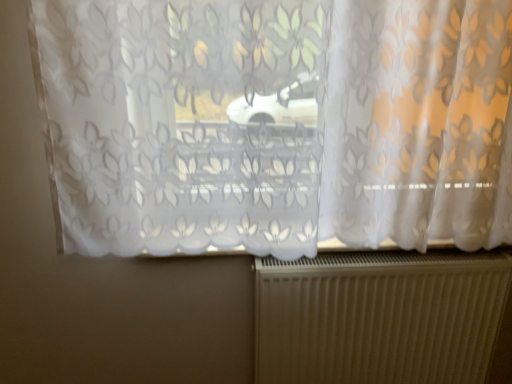
Identify the location of metallic ribbed radiator at bottom. The width and height of the screenshot is (512, 384). (380, 316).

In order to face metallic ribbed radiator at bottom, should I rotate leftwards or rightwards?

A 15.845 degree turn to the right will do.

What do you see at coordinates (380, 316) in the screenshot?
I see `metallic ribbed radiator at bottom` at bounding box center [380, 316].

Describe the element at coordinates (276, 123) in the screenshot. The height and width of the screenshot is (384, 512). I see `translucent floral-patterned curtain at center` at that location.

Find the location of `translucent floral-patterned curtain at center`. translucent floral-patterned curtain at center is located at coordinates (276, 123).

Locate an element on the screen. metallic ribbed radiator at bottom is located at coordinates (380, 316).

Does translucent floral-patterned curtain at center appear on the right side of metallic ribbed radiator at bottom?

No, translucent floral-patterned curtain at center is not to the right of metallic ribbed radiator at bottom.

Is translucent floral-patterned curtain at center positioned before metallic ribbed radiator at bottom?

Yes, translucent floral-patterned curtain at center is in front of metallic ribbed radiator at bottom.

Is point (273, 238) closer or farther from the camera than point (319, 340)?

Point (273, 238).

Based on the photo, from the image's perspective, is translucent floral-patterned curtain at center located beneath metallic ribbed radiator at bottom?

No, from the image's perspective, translucent floral-patterned curtain at center is not beneath metallic ribbed radiator at bottom.

From a real-world perspective, who is located higher, translucent floral-patterned curtain at center or metallic ribbed radiator at bottom?

translucent floral-patterned curtain at center.

Based on the photo, is translucent floral-patterned curtain at center wider than metallic ribbed radiator at bottom?

Indeed, translucent floral-patterned curtain at center has a greater width compared to metallic ribbed radiator at bottom.

Consider the image. Is translucent floral-patterned curtain at center taller or shorter than metallic ribbed radiator at bottom?

In the image, translucent floral-patterned curtain at center appears to be taller than metallic ribbed radiator at bottom.

Between translucent floral-patterned curtain at center and metallic ribbed radiator at bottom, which one has larger size?

Bigger between the two is translucent floral-patterned curtain at center.

Would you say translucent floral-patterned curtain at center contains metallic ribbed radiator at bottom?

No.

Based on the photo, is the surface of translucent floral-patterned curtain at center in direct contact with metallic ribbed radiator at bottom?

No, translucent floral-patterned curtain at center is not in contact with metallic ribbed radiator at bottom.

Could you tell me if translucent floral-patterned curtain at center is turned towards metallic ribbed radiator at bottom?

No, translucent floral-patterned curtain at center is not oriented towards metallic ribbed radiator at bottom.

How many degrees apart are the facing directions of translucent floral-patterned curtain at center and metallic ribbed radiator at bottom?

The angular difference between translucent floral-patterned curtain at center and metallic ribbed radiator at bottom is 0.716 degrees.

Locate an element on the screen. curtain above the metallic ribbed radiator at bottom (from the image's perspective) is located at coordinates (276, 123).

Is metallic ribbed radiator at bottom at the left side of translucent floral-patterned curtain at center?

In fact, metallic ribbed radiator at bottom is to the right of translucent floral-patterned curtain at center.

Which object is closer to the camera, metallic ribbed radiator at bottom or translucent floral-patterned curtain at center?

translucent floral-patterned curtain at center is closer to the camera.

Which is behind, point (443, 351) or point (406, 15)?

Positioned behind is point (443, 351).

From the image's perspective, is metallic ribbed radiator at bottom beneath translucent floral-patterned curtain at center?

Yes, from the image's perspective, metallic ribbed radiator at bottom is below translucent floral-patterned curtain at center.

Consider the image. From a real-world perspective, which object stands above the other?

translucent floral-patterned curtain at center.

Does metallic ribbed radiator at bottom have a lesser width compared to translucent floral-patterned curtain at center?

Correct, the width of metallic ribbed radiator at bottom is less than that of translucent floral-patterned curtain at center.

Considering the relative sizes of metallic ribbed radiator at bottom and translucent floral-patterned curtain at center in the image provided, is metallic ribbed radiator at bottom taller than translucent floral-patterned curtain at center?

No.

Is metallic ribbed radiator at bottom smaller than translucent floral-patterned curtain at center?

Yes, metallic ribbed radiator at bottom is smaller than translucent floral-patterned curtain at center.

Is metallic ribbed radiator at bottom completely or partially outside of translucent floral-patterned curtain at center?

That's correct, metallic ribbed radiator at bottom is outside of translucent floral-patterned curtain at center.

Would you say metallic ribbed radiator at bottom is a long distance from translucent floral-patterned curtain at center?

They are positioned close to each other.

Does metallic ribbed radiator at bottom turn towards translucent floral-patterned curtain at center?

No, metallic ribbed radiator at bottom is not turned towards translucent floral-patterned curtain at center.

Can you tell me how much metallic ribbed radiator at bottom and translucent floral-patterned curtain at center differ in facing direction?

The angle between the facing direction of metallic ribbed radiator at bottom and the facing direction of translucent floral-patterned curtain at center is 0.716 degrees.

I want to click on radiator that is below the translucent floral-patterned curtain at center (from the image's perspective), so click(x=380, y=316).

Identify the location of curtain above the metallic ribbed radiator at bottom (from a real-world perspective). The height and width of the screenshot is (384, 512). (276, 123).

You are a GUI agent. You are given a task and a screenshot of the screen. Output one action in this format:
    pyautogui.click(x=<x>, y=<y>)
    Task: Click on the radiator located underneath the translucent floral-patterned curtain at center (from a real-world perspective)
    
    Given the screenshot: What is the action you would take?
    pyautogui.click(x=380, y=316)